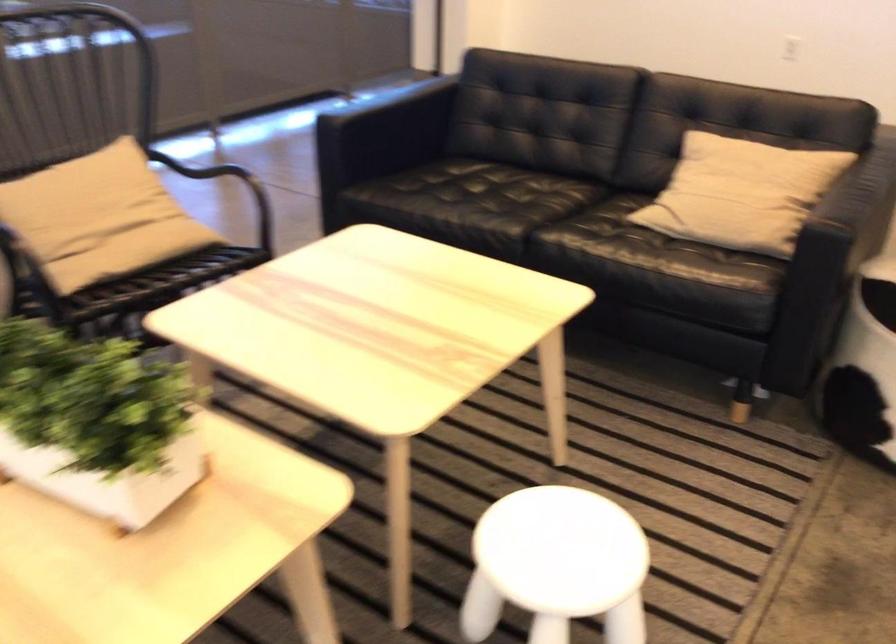
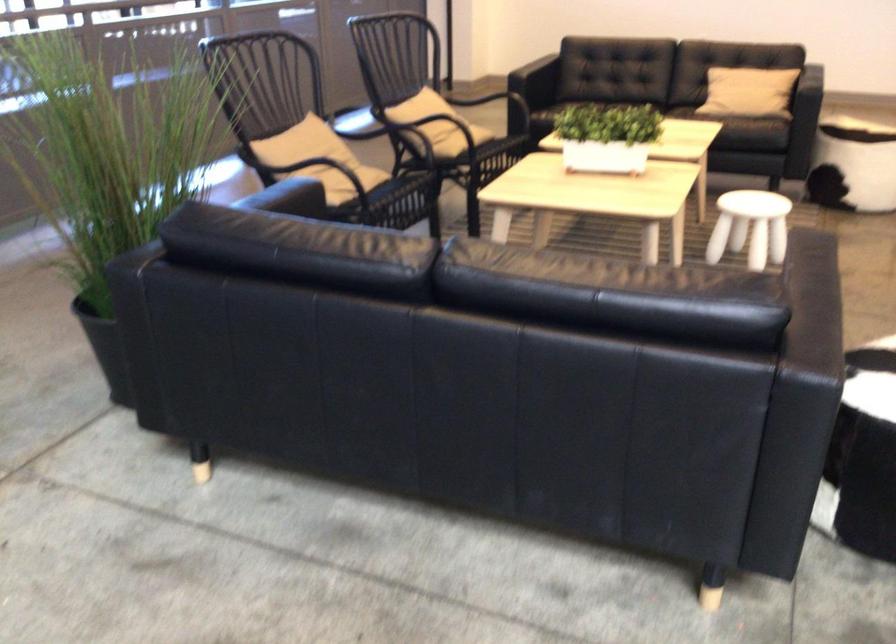
In the second image, find the point that corresponds to pixel 624 283 in the first image.

(745, 120)